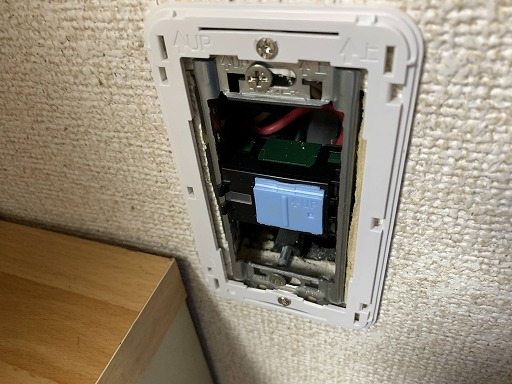
In order to click on blue plastic outlet piece in this screenshot , I will do `click(258, 180)`, `click(284, 188)`, `click(317, 192)`, `click(317, 212)`, `click(317, 233)`, `click(288, 227)`, `click(298, 206)`, `click(270, 203)`, `click(256, 195)`, `click(258, 220)`.